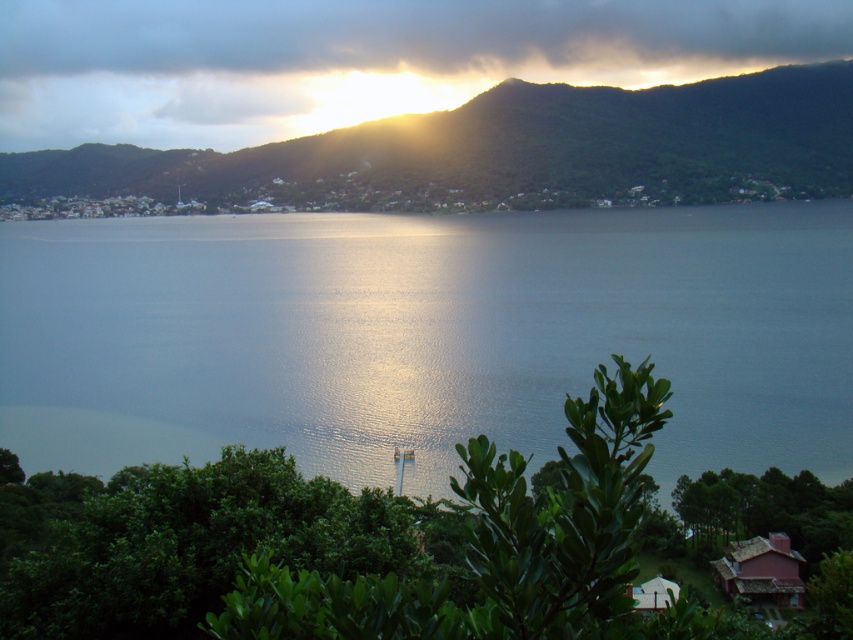
Question: Estimate the real-world distances between objects in this image. Which object is farther from the cloudy sky at upper center?

Choices:
 (A) glistening blue water at center
 (B) green leafy mountain at upper center

Answer: (A)

Question: Is glistening blue water at center to the right of green leafy mountain at upper center from the viewer's perspective?

Choices:
 (A) no
 (B) yes

Answer: (B)

Question: Is glistening blue water at center positioned behind green leafy mountain at upper center?

Choices:
 (A) yes
 (B) no

Answer: (B)

Question: Among these points, which one is farthest from the camera?

Choices:
 (A) (834, 371)
 (B) (427, 67)

Answer: (B)

Question: Among these points, which one is nearest to the camera?

Choices:
 (A) (107, 336)
 (B) (177, 168)

Answer: (A)

Question: Is glistening blue water at center wider than cloudy sky at upper center?

Choices:
 (A) yes
 (B) no

Answer: (B)